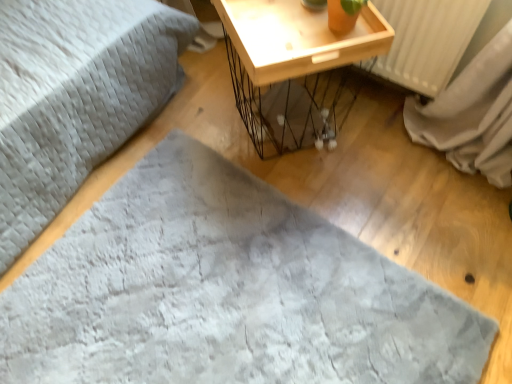
In order to click on vacant space that is in between wooden tray at upper right and gray soft fabric at center in this screenshot , I will do `click(343, 191)`.